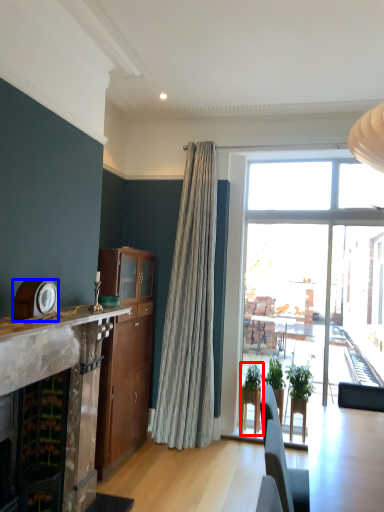
Question: Which object appears farthest to the camera in this image, houseplant (highlighted by a red box) or clock (highlighted by a blue box)?

Choices:
 (A) houseplant
 (B) clock

Answer: (A)